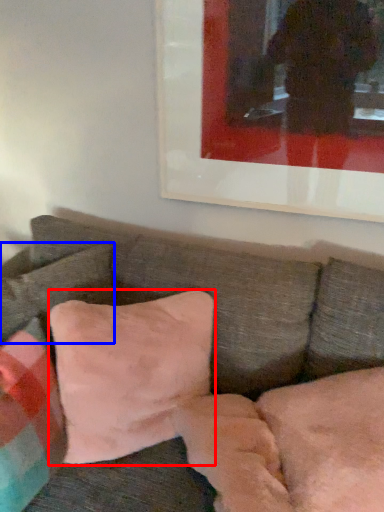
Question: Which object is further to the camera taking this photo, pillow (highlighted by a red box) or pillow (highlighted by a blue box)?

Choices:
 (A) pillow
 (B) pillow

Answer: (B)